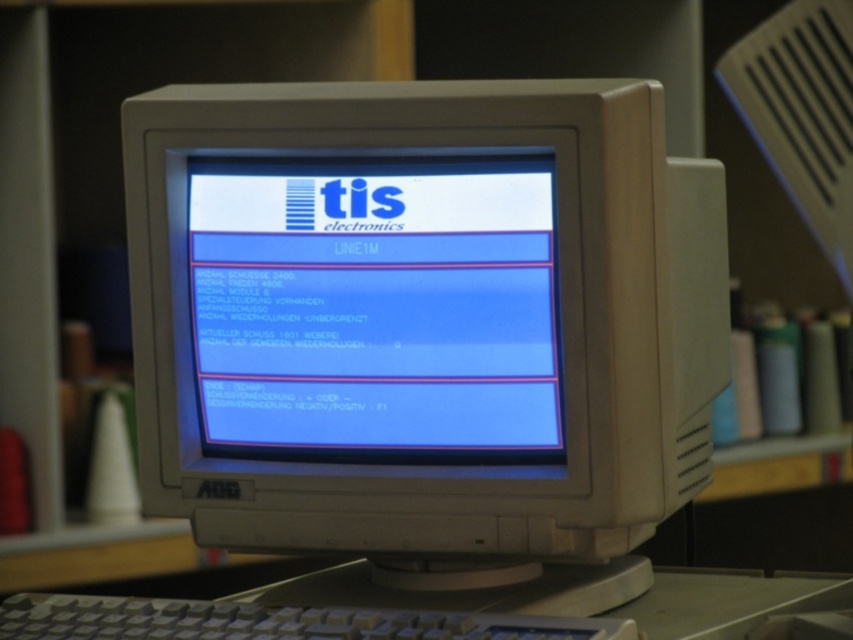
Question: Which object appears farthest from the camera in this image?

Choices:
 (A) blue glossy monitor at center
 (B) white plastic computer desk at center

Answer: (A)

Question: Is matte white bookshelf at center bigger than gray plastic keyboard at center?

Choices:
 (A) yes
 (B) no

Answer: (A)

Question: Is white plastic computer desk at center further to camera compared to blue glossy monitor at center?

Choices:
 (A) yes
 (B) no

Answer: (B)

Question: Which point is closer to the camera?

Choices:
 (A) (483, 502)
 (B) (540, 621)

Answer: (B)

Question: Can you confirm if matte white bookshelf at center is positioned below gray plastic keyboard at center?

Choices:
 (A) yes
 (B) no

Answer: (B)

Question: Estimate the real-world distances between objects in this image. Which object is farther from the matte white bookshelf at center?

Choices:
 (A) white plastic computer desk at center
 (B) gray plastic keyboard at center

Answer: (B)